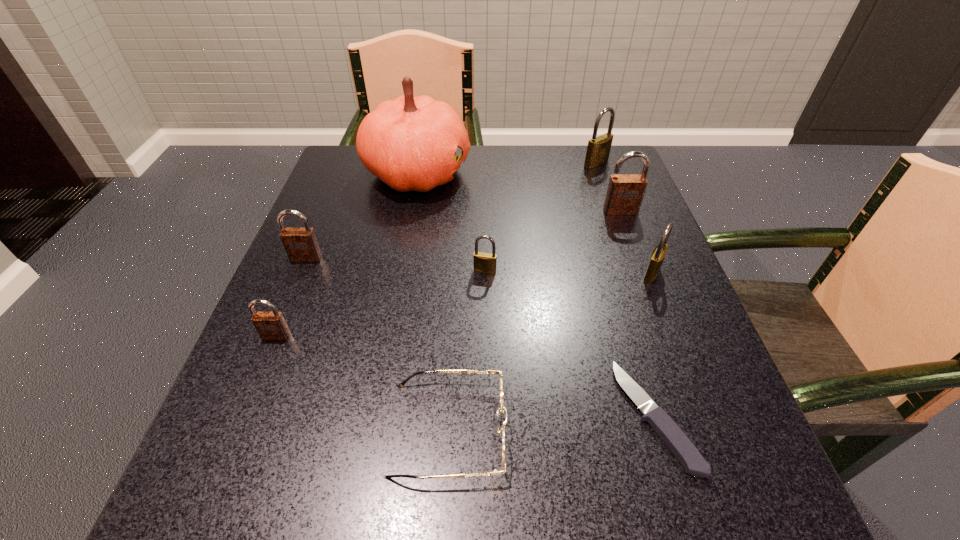
Find the location of a particular element. Image resolution: width=960 pixels, height=540 pixels. free spot located on the front-facing side of the second biggest brown padlock is located at coordinates (247, 403).

Find the location of `vacant area located on the back of the smallest brass padlock`. vacant area located on the back of the smallest brass padlock is located at coordinates [x=484, y=177].

What are the coordinates of `free location located on the front-facing side of the seventh farthest object` in the screenshot? It's located at coord(232,443).

This screenshot has height=540, width=960. I want to click on free space located on the lenses of the eighth tallest object, so click(x=624, y=429).

Locate an element on the screen. vacant space located on the left of the shortest object is located at coordinates (433, 416).

You are a GUI agent. You are given a task and a screenshot of the screen. Output one action in this format:
    pyautogui.click(x=<x>, y=<y>)
    Task: Click on the pumpkin present at the far edge
    
    Given the screenshot: What is the action you would take?
    pyautogui.click(x=410, y=143)

This screenshot has width=960, height=540. What are the coordinates of `padlock that is positioned at the far edge` in the screenshot? It's located at (598, 150).

The image size is (960, 540). I want to click on spectacles at the near edge, so click(503, 409).

Locate an element on the screen. steak knife that is positioned at the near edge is located at coordinates (679, 444).

At what (x,y) coordinates should I click in order to perform the action: click on pumpkin that is at the left edge. Please return your answer as a coordinate pair (x, y). Image resolution: width=960 pixels, height=540 pixels. Looking at the image, I should click on (410, 143).